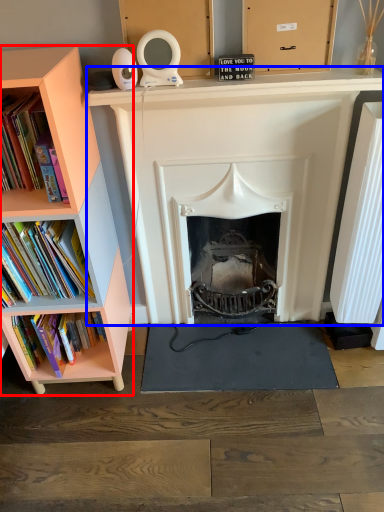
Question: Which point is closer to the camera, bookcase (highlighted by a red box) or fireplace (highlighted by a blue box)?

Choices:
 (A) bookcase
 (B) fireplace

Answer: (A)